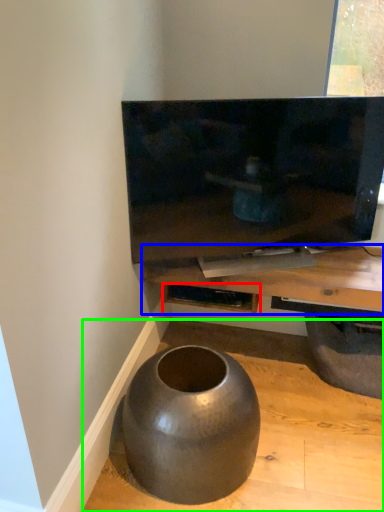
Question: Which is farther away from shelf (highlighted by a red box)? table (highlighted by a blue box) or concrete (highlighted by a green box)?

Choices:
 (A) table
 (B) concrete

Answer: (B)